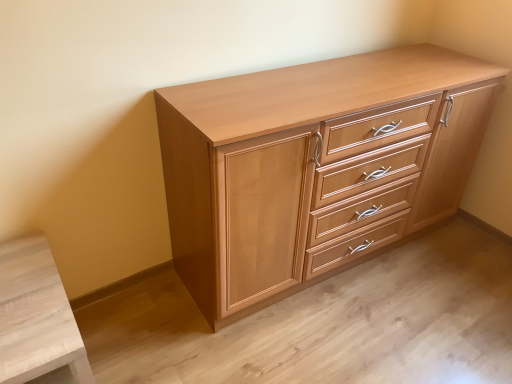
This screenshot has height=384, width=512. In order to click on free point behind light wood cabinet at lower left in this screenshot , I will do `click(122, 316)`.